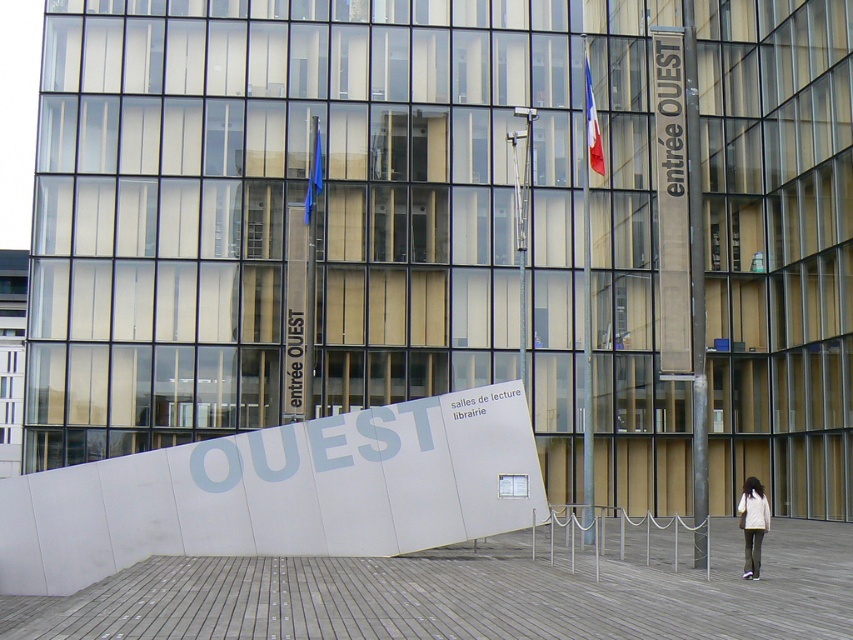
Question: Which object is the farthest from the french flag at upper center?

Choices:
 (A) blue fabric flag at center
 (B) white cotton jacket at lower right

Answer: (B)

Question: Which of the following is the farthest from the observer?

Choices:
 (A) blue fabric flag at center
 (B) white cotton jacket at lower right

Answer: (A)

Question: Is white cotton jacket at lower right to the right of blue fabric flag at center from the viewer's perspective?

Choices:
 (A) yes
 (B) no

Answer: (A)

Question: Can you confirm if french flag at upper center is positioned below blue fabric flag at center?

Choices:
 (A) no
 (B) yes

Answer: (A)

Question: Is white cotton jacket at lower right thinner than french flag at upper center?

Choices:
 (A) yes
 (B) no

Answer: (A)

Question: Among these points, which one is nearest to the camera?

Choices:
 (A) (315, 177)
 (B) (598, 136)

Answer: (B)